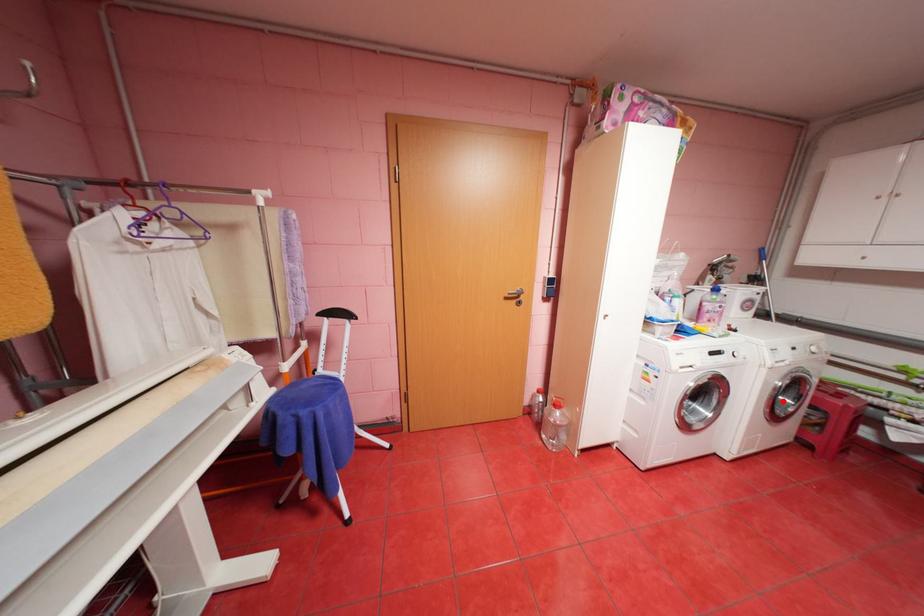
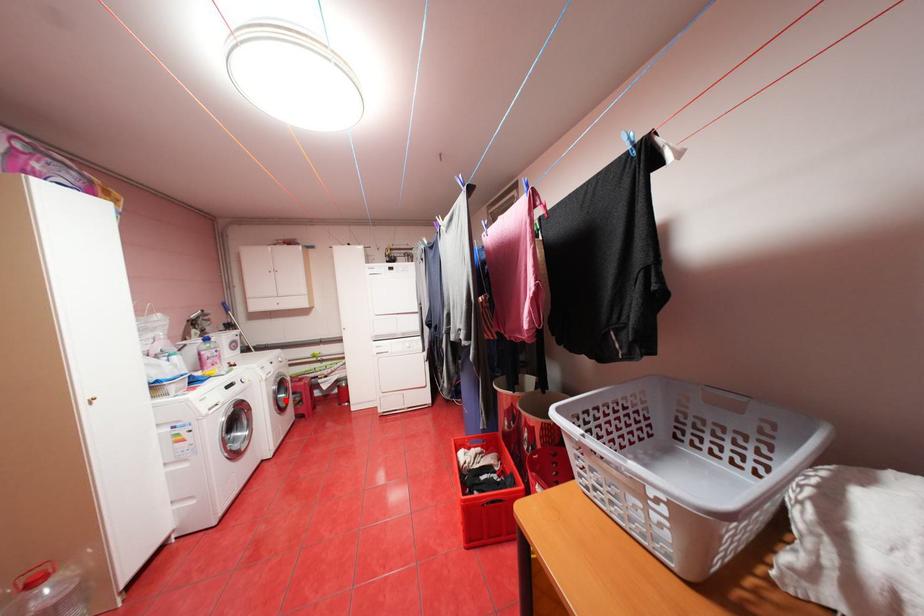
I am providing you with two images of the same scene from different viewpoints. A red point is marked on the first image and another point is marked on the second image. Does the point marked in image1 correspond to the same location as the one in image2?

Yes